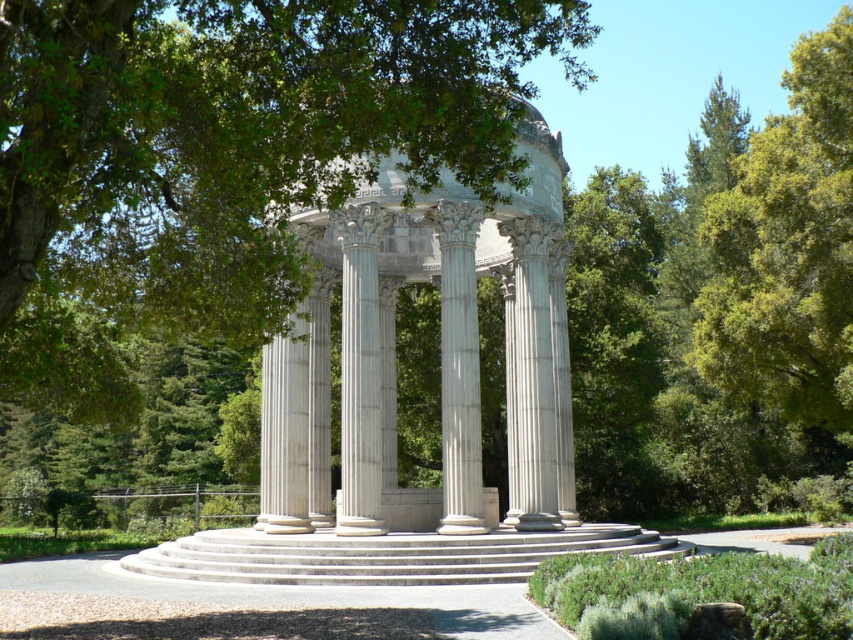
You are a visitor standing at the entrance of the temple structure. You see the green leafy tree at center and the white marble gazebo at center. Which object is directly above the other?

The green leafy tree at center is positioned over the white marble gazebo at center, so the tree is directly above the gazebo.

You are planning to place a new statue in the garden. The statue requires a base that can support its weight. Which object between the white marble gazebo at center and the white marble column at center would be more suitable as a base for the statue?

The white marble gazebo at center has a larger size compared to the white marble column at center, making it more suitable as a base for the statue since it can provide a sturdier and more stable foundation.

You are planning to host a small outdoor event and need to decide whether the green leafy tree at center can provide enough shade for the white marble gazebo at center. Based on their sizes, which one is wider?

The green leafy tree at center is wider than the white marble gazebo at center, so it can provide sufficient shade.